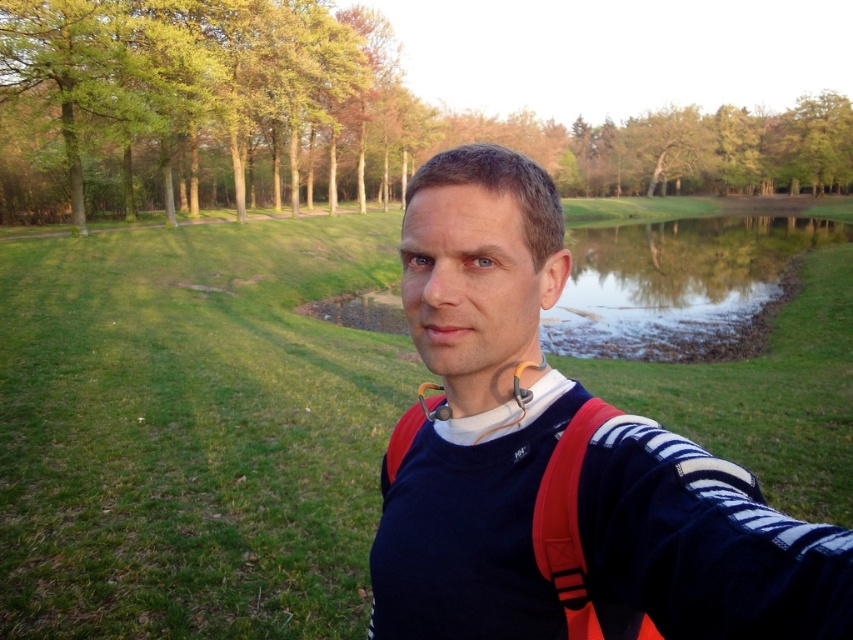
Question: Can you confirm if navy blue sweater at center is thinner than clear water at pond right?

Choices:
 (A) no
 (B) yes

Answer: (B)

Question: Which object is positioned farthest from the navy blue sweater at center?

Choices:
 (A) clear water at pond right
 (B) green leafy tree at upper center

Answer: (B)

Question: Is navy blue sweater at center thinner than clear water at pond right?

Choices:
 (A) yes
 (B) no

Answer: (A)

Question: Can you confirm if navy blue sweater at center is thinner than green leafy tree at upper center?

Choices:
 (A) no
 (B) yes

Answer: (B)

Question: Estimate the real-world distances between objects in this image. Which object is closer to the navy blue sweater at center?

Choices:
 (A) green leafy tree at upper center
 (B) clear water at pond right

Answer: (B)

Question: Which of these objects is positioned farthest from the green leafy tree at upper center?

Choices:
 (A) navy blue sweater at center
 (B) clear water at pond right

Answer: (A)